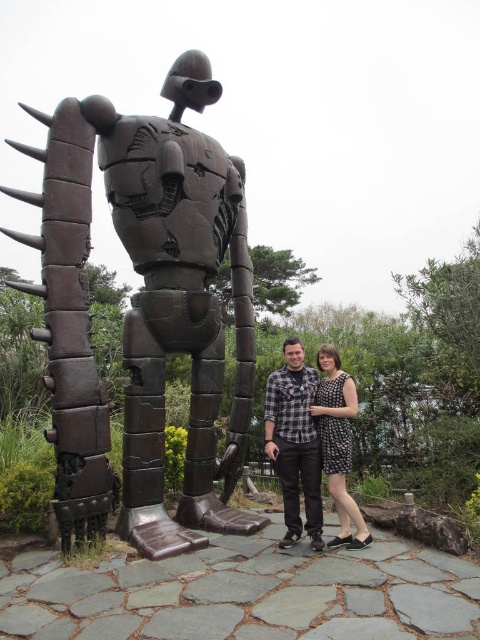
What do you see at coordinates (295, 442) in the screenshot?
I see `checkered fabric shirt at center` at bounding box center [295, 442].

Which is above, checkered fabric shirt at center or black dotted dress at center?

checkered fabric shirt at center

Does point (290, 406) lie in front of point (361, 545)?

No.

Locate an element on the screen. Image resolution: width=480 pixels, height=640 pixels. checkered fabric shirt at center is located at coordinates 295,442.

Is bronze metallic robot at center to the left of black dotted dress at center from the viewer's perspective?

Yes, bronze metallic robot at center is to the left of black dotted dress at center.

Does point (202, 488) lie in front of point (322, 355)?

No, (202, 488) is behind (322, 355).

I want to click on bronze metallic robot at center, so (144, 308).

The width and height of the screenshot is (480, 640). I want to click on bronze metallic robot at center, so click(144, 308).

Is bronze metallic robot at center smaller than checkered fabric shirt at center?

Actually, bronze metallic robot at center might be larger than checkered fabric shirt at center.

Where is `bronze metallic robot at center`? The width and height of the screenshot is (480, 640). bronze metallic robot at center is located at coordinates (144, 308).

Is point (187, 70) in front of point (286, 490)?

No, it is behind (286, 490).

Where is `bronze metallic robot at center`? bronze metallic robot at center is located at coordinates (144, 308).